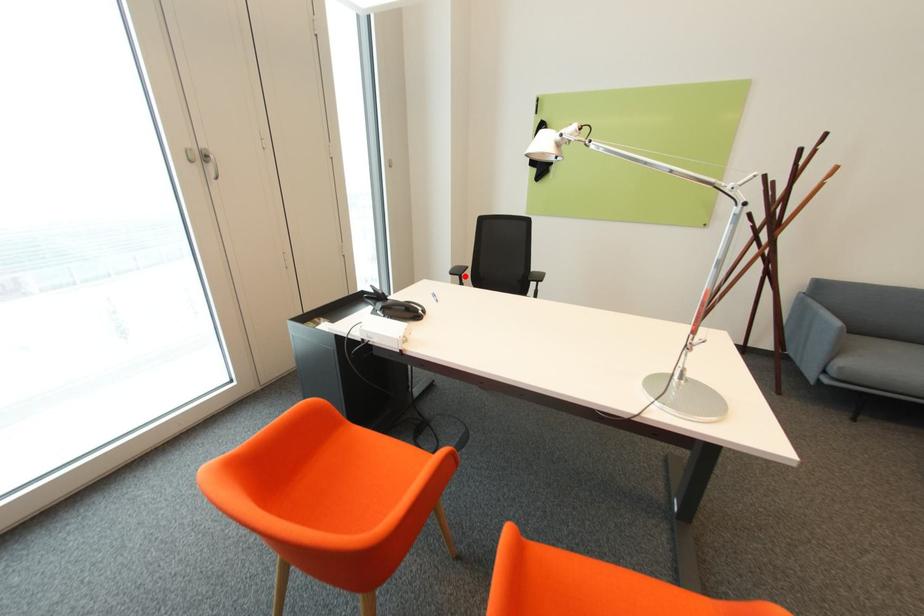
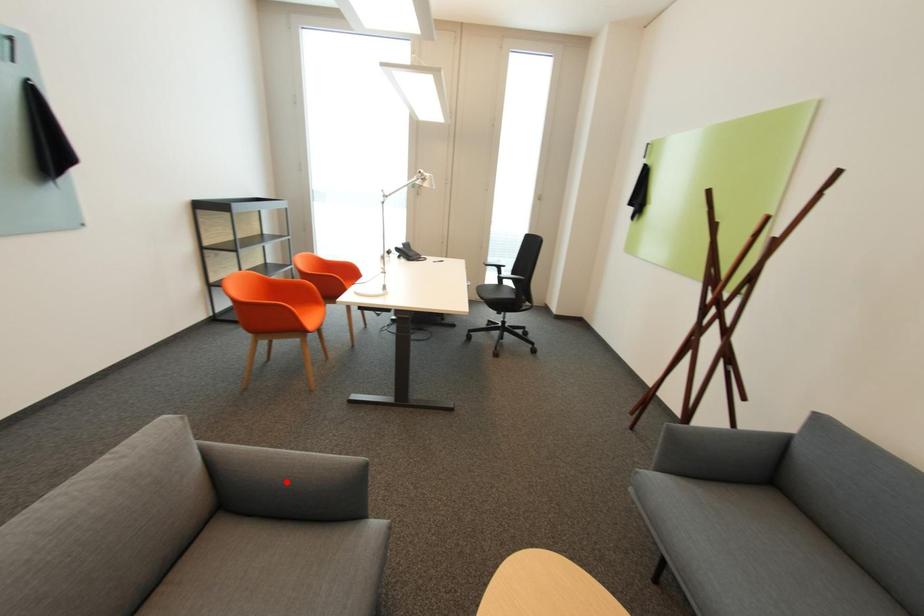
I am providing you with two images of the same scene from different viewpoints. A red point is marked on the first image and another point is marked on the second image. Is the marked point in image1 the same physical position as the marked point in image2?

No